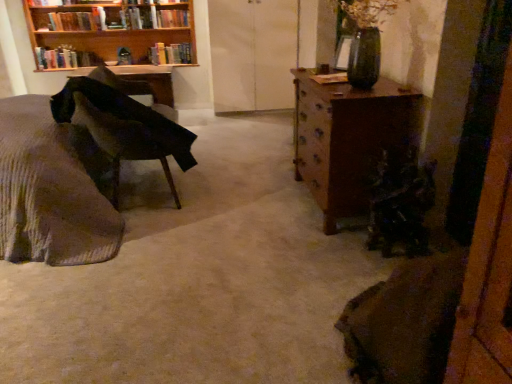
Question: From the image's perspective, is hardcover books at upper left, acting as the 3th book starting from the right, above or below woolen fabric bed at left?

Choices:
 (A) above
 (B) below

Answer: (A)

Question: Is hardcover books at upper left, acting as the 3th book starting from the right, bigger or smaller than woolen fabric bed at left?

Choices:
 (A) big
 (B) small

Answer: (B)

Question: Considering the real-world distances, which object is closest to the hardcover book at upper center, which is the 3th book in left-to-right order?

Choices:
 (A) wooden desk at left
 (B) hardcover book at upper left, which appears as the 2th book when viewed from the left
 (C) wooden bookshelf at upper left
 (D) woolen fabric bed at left
 (E) hardcover books at upper left, acting as the 3th book starting from the right

Answer: (A)

Question: Considering the real-world distances, which object is farthest from the hardcover books at upper left, acting as the 3th book starting from the right?

Choices:
 (A) hardcover book at upper left, the 2th book positioned from the right
 (B) velvet dark green chair at left
 (C) wooden bookshelf at upper left
 (D) hardcover book at upper center, which is the 3th book in left-to-right order
 (E) woolen fabric bed at left

Answer: (E)